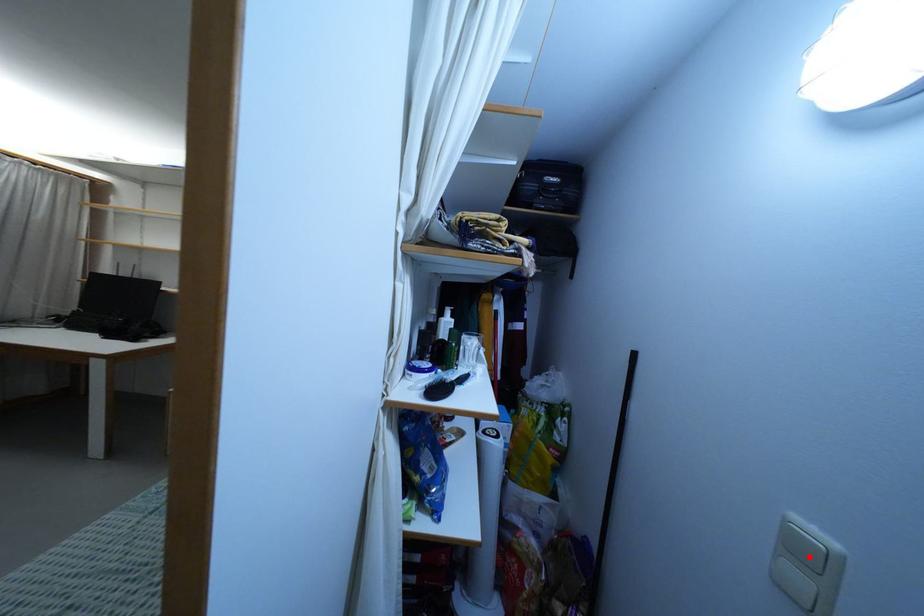
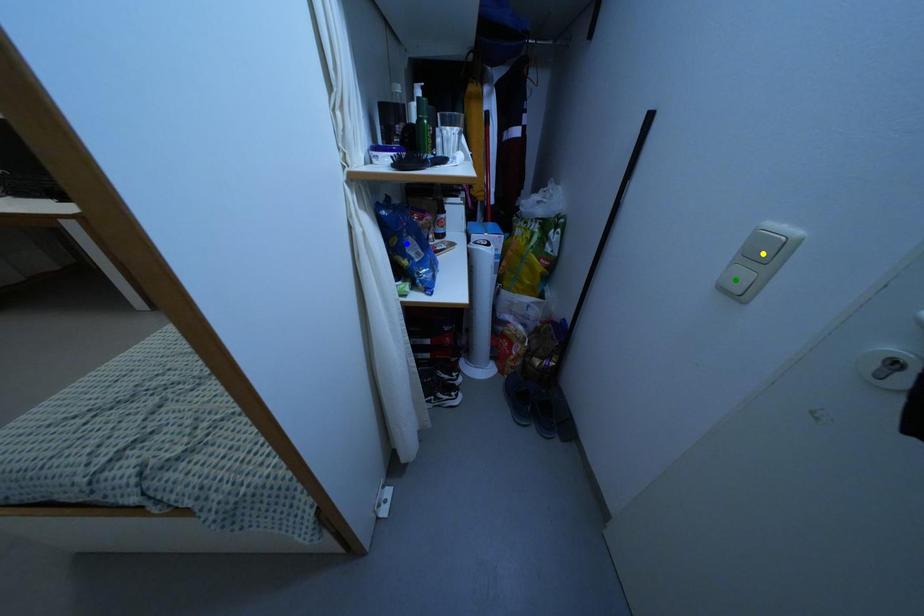
Question: I am providing you with two images of the same scene from different viewpoints. A red point is marked on the first image. You are given multiple points on the second image. Which point in image 2 is actually the same real-world point as the red point in image 1?

Choices:
 (A) yellow point
 (B) green point
 (C) blue point

Answer: (A)